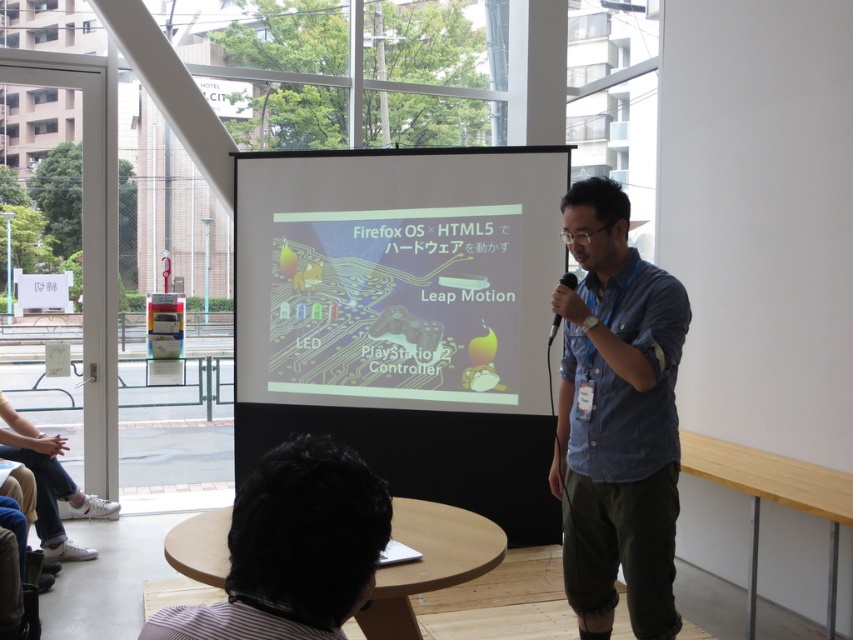
Describe the element at coordinates (293, 548) in the screenshot. This screenshot has height=640, width=853. I see `black striped shirt at lower left` at that location.

Can you confirm if black striped shirt at lower left is positioned to the left of black matte microphone at center?

Indeed, black striped shirt at lower left is positioned on the left side of black matte microphone at center.

Which is behind, point (288, 461) or point (569, 289)?

Point (569, 289)

Identify the location of black striped shirt at lower left. This screenshot has width=853, height=640. (293, 548).

Does blue denim shirt at center have a larger size compared to black matte microphone at center?

Indeed, blue denim shirt at center has a larger size compared to black matte microphone at center.

Who is positioned more to the right, blue denim shirt at center or black matte microphone at center?

Positioned to the right is blue denim shirt at center.

Is point (669, 404) closer to camera compared to point (572, 280)?

That is True.

Locate an element on the screen. blue denim shirt at center is located at coordinates (618, 419).

Which is above, white glossy projector screen at center or blue denim shirt at center?

Positioned higher is white glossy projector screen at center.

Which is behind, point (331, 285) or point (583, 428)?

The point (331, 285) is behind.

Describe the element at coordinates (396, 275) in the screenshot. This screenshot has height=640, width=853. I see `white glossy projector screen at center` at that location.

Find the location of a particular element. white glossy projector screen at center is located at coordinates (396, 275).